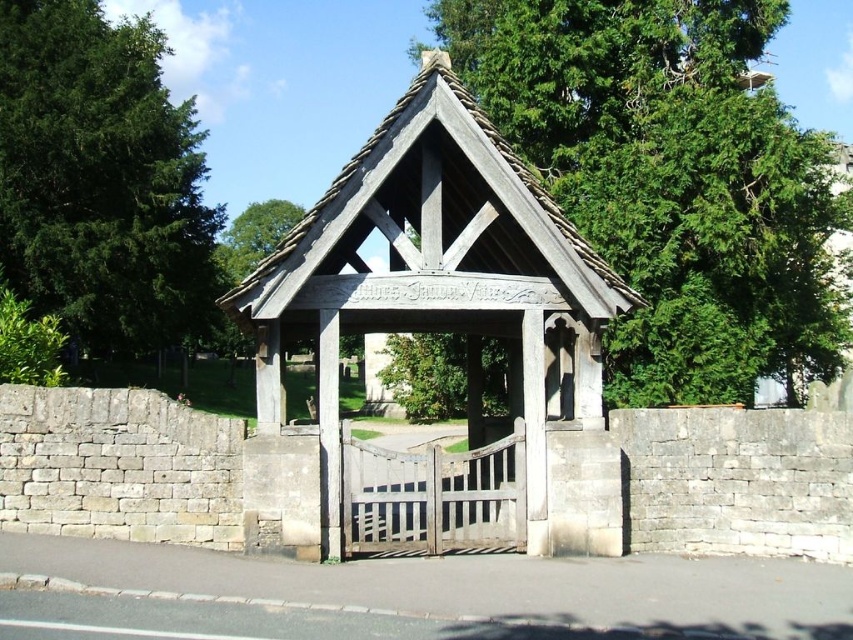
What do you see at coordinates (671, 179) in the screenshot? I see `green leafy tree at upper center` at bounding box center [671, 179].

Identify the location of green leafy tree at upper center. The width and height of the screenshot is (853, 640). (671, 179).

Does point (506, 3) come farther from viewer compared to point (178, 321)?

No.

At what (x,y) coordinates should I click in order to perform the action: click on green leafy tree at upper center. Please return your answer as a coordinate pair (x, y). This screenshot has height=640, width=853. Looking at the image, I should click on (671, 179).

Between wooden gazebo at center and green leafy tree at left, which one is positioned higher?

green leafy tree at left

Between point (340, 214) and point (76, 1), which one is positioned in front?

Point (340, 214)

I want to click on wooden gazebo at center, so click(437, 278).

Locate an element on the screen. wooden gazebo at center is located at coordinates (437, 278).

Which is in front, point (770, 28) or point (456, 129)?

Positioned in front is point (456, 129).

Which is above, green leafy tree at upper center or wooden gazebo at center?

green leafy tree at upper center is above.

Describe the element at coordinates (671, 179) in the screenshot. This screenshot has height=640, width=853. I see `green leafy tree at upper center` at that location.

You are a GUI agent. You are given a task and a screenshot of the screen. Output one action in this format:
    pyautogui.click(x=<x>, y=<y>)
    Task: Click on the green leafy tree at upper center
    The height and width of the screenshot is (640, 853).
    Given the screenshot: What is the action you would take?
    click(x=671, y=179)